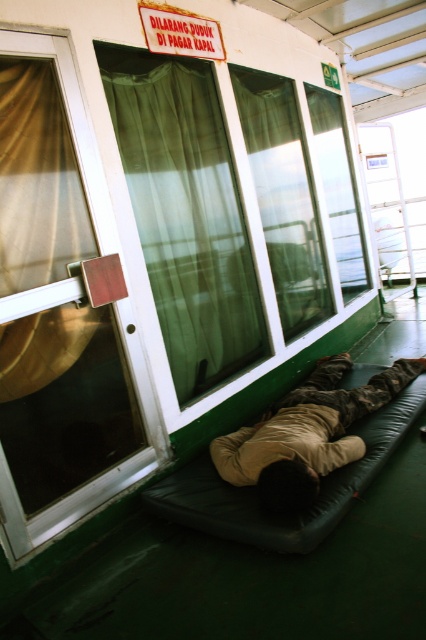
Question: Which of the following is the farthest from the observer?

Choices:
 (A) (192, 218)
 (B) (40, 170)
 (C) (374, 385)

Answer: (C)

Question: Can you confirm if translucent fabric curtain at left is positioned above camouflage fabric person at lower center?

Choices:
 (A) yes
 (B) no

Answer: (A)

Question: Which object is positioned farthest from the green sheer curtain at upper center?

Choices:
 (A) translucent fabric curtain at left
 (B) camouflage fabric person at lower center

Answer: (B)

Question: Estimate the real-world distances between objects in this image. Which object is closer to the camouflage fabric person at lower center?

Choices:
 (A) translucent fabric curtain at left
 (B) green sheer curtain at upper center

Answer: (B)

Question: Does translucent fabric curtain at left come in front of camouflage fabric person at lower center?

Choices:
 (A) yes
 (B) no

Answer: (A)

Question: Can you confirm if green sheer curtain at upper center is positioned to the right of camouflage fabric person at lower center?

Choices:
 (A) no
 (B) yes

Answer: (A)